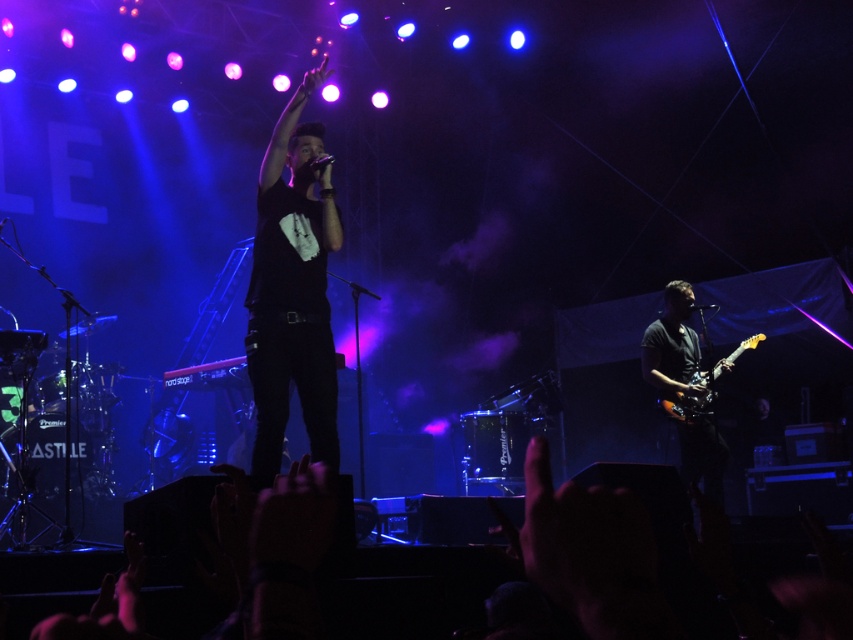
Question: Among these points, which one is nearest to the camera?

Choices:
 (A) (283, 266)
 (B) (692, 406)
 (C) (643, 362)

Answer: (A)

Question: Observing the image, what is the correct spatial positioning of black matte shirt at center in reference to glossy wood electric guitar at right?

Choices:
 (A) right
 (B) left

Answer: (B)

Question: Which object appears farthest from the camera in this image?

Choices:
 (A) glossy wood electric guitar at right
 (B) black matte shirt at center

Answer: (A)

Question: Considering the relative positions of shiny black guitar at right and glossy wood electric guitar at right in the image provided, where is shiny black guitar at right located with respect to glossy wood electric guitar at right?

Choices:
 (A) below
 (B) above

Answer: (A)

Question: Is black matte shirt at center to the left of glossy wood electric guitar at right from the viewer's perspective?

Choices:
 (A) yes
 (B) no

Answer: (A)

Question: Among these points, which one is farthest from the camera?

Choices:
 (A) (271, 419)
 (B) (654, 324)
 (C) (709, 378)

Answer: (B)